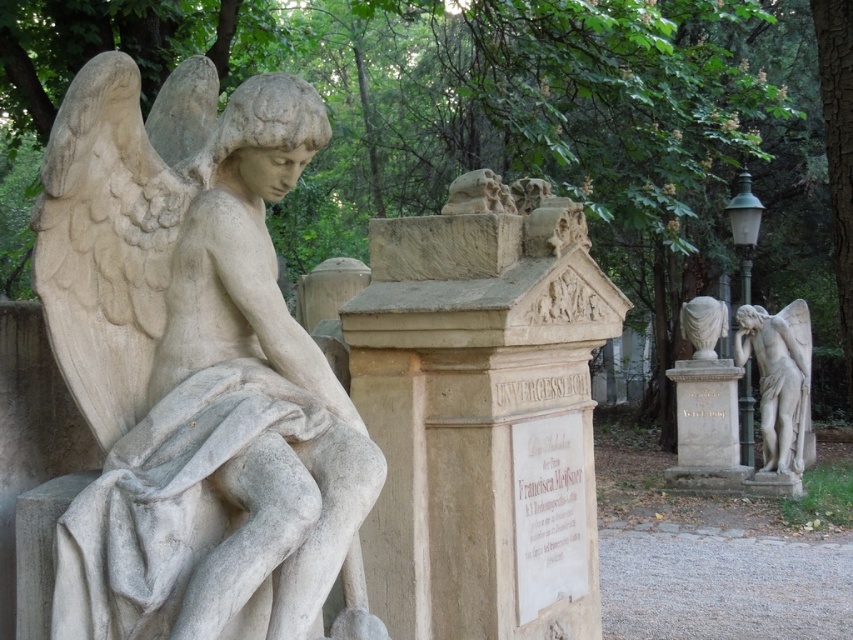
Question: Which object is farther from the camera taking this photo?

Choices:
 (A) white marble bust at center
 (B) beige stone monument at center
 (C) matte stone angel at right

Answer: (A)

Question: Which point is closer to the camera taking this photo?

Choices:
 (A) (730, 371)
 (B) (798, 346)
 (C) (195, 628)

Answer: (C)

Question: Is beige stone monument at center thinner than white marble statue at center?

Choices:
 (A) no
 (B) yes

Answer: (A)

Question: Can you confirm if white stone angel at left is positioned above white marble bust at center?

Choices:
 (A) yes
 (B) no

Answer: (A)

Question: Is the position of beige stone monument at center more distant than that of matte stone angel at right?

Choices:
 (A) no
 (B) yes

Answer: (A)

Question: Which is nearer to the matte stone angel at right?

Choices:
 (A) white marble bust at center
 (B) beige stone monument at center

Answer: (A)